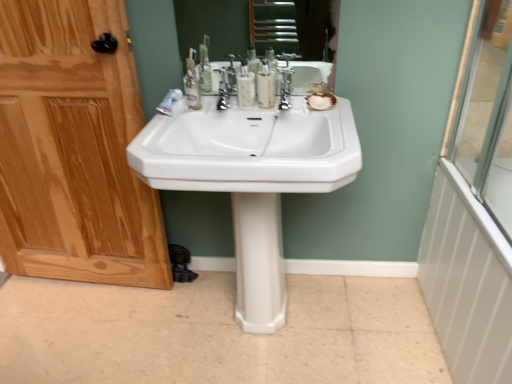
Find the location of a particular element. This screenshot has width=512, height=384. vacant space underneath white glossy sink at center (from a real-world perspective) is located at coordinates (250, 331).